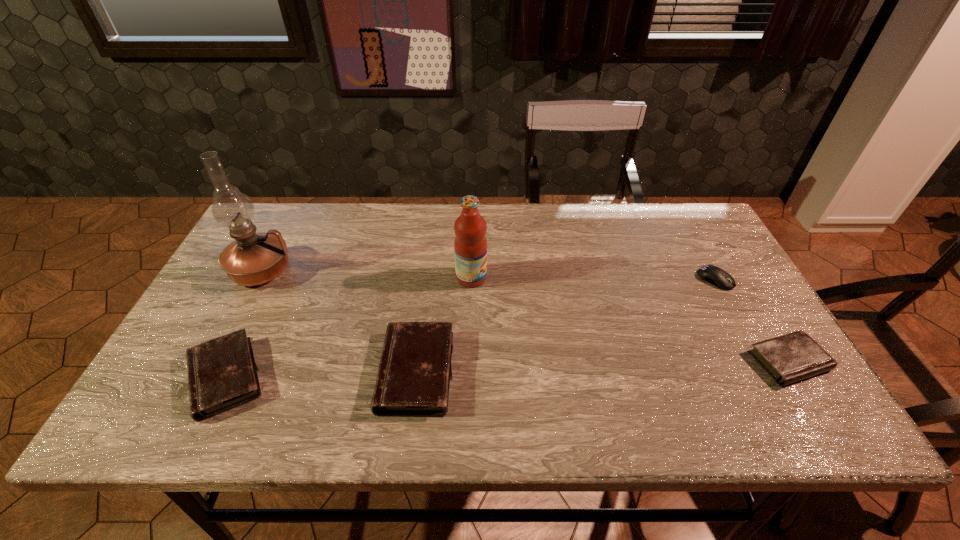
In the image, there is a desktop. Where is `vacant area at the far edge`? The image size is (960, 540). vacant area at the far edge is located at coordinates pos(551,217).

Where is `blank space at the near edge`? The image size is (960, 540). blank space at the near edge is located at coordinates (508, 390).

Find the location of `vacant region at the left edge of the desktop`. vacant region at the left edge of the desktop is located at coordinates (231, 313).

This screenshot has width=960, height=540. In order to click on vacant space at the right edge of the desktop in this screenshot , I will do `click(707, 292)`.

Locate an element on the screen. This screenshot has height=540, width=960. blank space at the far left corner is located at coordinates (304, 203).

Find the location of a particular element. This screenshot has height=540, width=960. vacant space at the far right corner of the desktop is located at coordinates (692, 207).

Locate an element on the screen. unoccupied area between the tallest object and the leftmost diary is located at coordinates (244, 324).

You are a GUI agent. You are given a task and a screenshot of the screen. Output one action in this format:
    pyautogui.click(x=<x>, y=<y>)
    Task: Click on the free space between the computer equipment and the third shortest object
    
    Given the screenshot: What is the action you would take?
    pyautogui.click(x=470, y=328)

You are a GUI agent. You are given a task and a screenshot of the screen. Output one action in this format:
    pyautogui.click(x=<x>, y=<y>)
    Task: Click on the free spot between the leftmost diary and the computer equipment
    The image size is (960, 540).
    Given the screenshot: What is the action you would take?
    pyautogui.click(x=470, y=328)

Where is `free point between the shortest diary and the leftmost diary`? Image resolution: width=960 pixels, height=540 pixels. free point between the shortest diary and the leftmost diary is located at coordinates (507, 369).